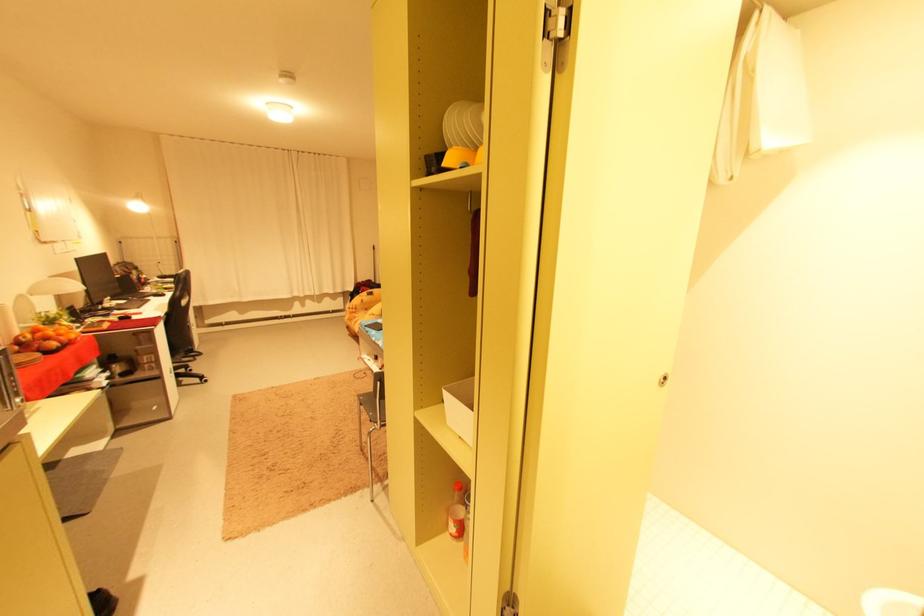
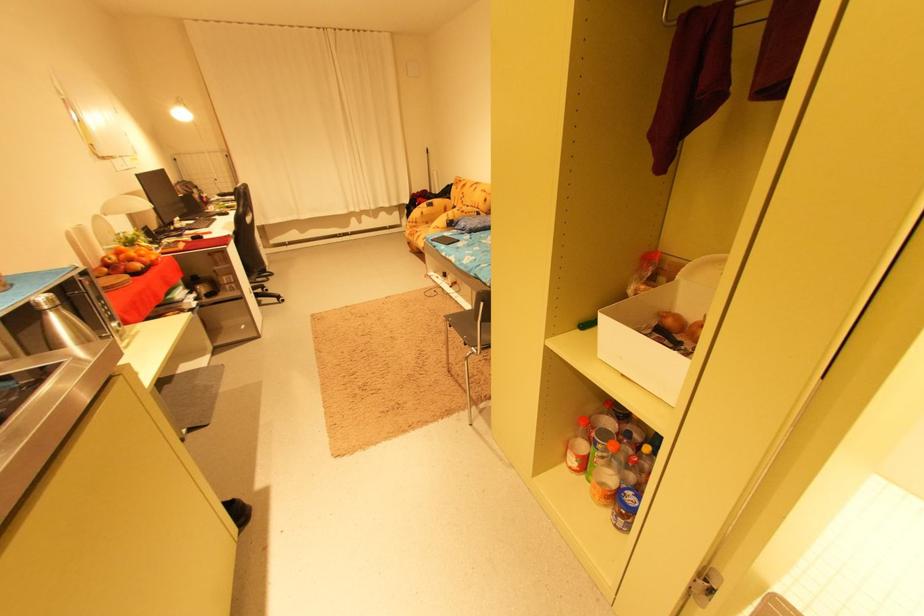
Where in the second image is the point corresponding to (175,314) from the first image?

(242, 233)